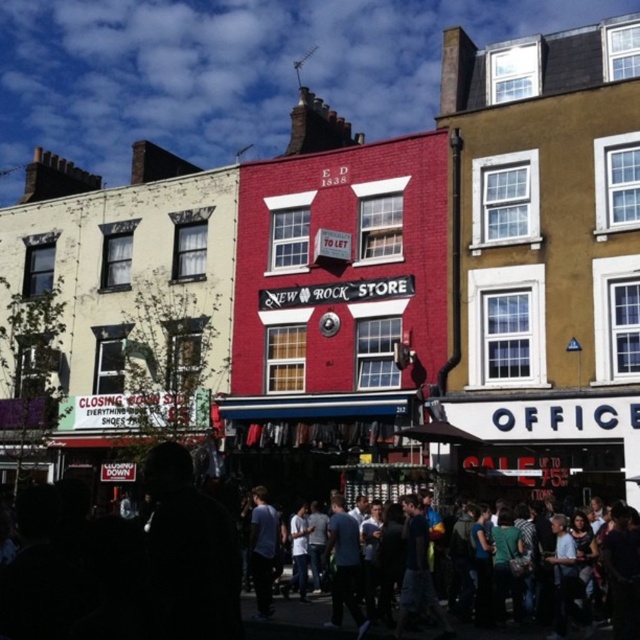
You are a street performer standing on the vibrant red brick building at center. You want to toss a coin to someone in the dark clothing crowd at center and light blue jeans at center. Which one is closer to you?

The dark clothing crowd at center is 11.74 meters from light blue jeans at center. Therefore, the light blue jeans at center is closer to you than the dark clothing crowd at center.

You are standing at the entrance of the cream colored building on the left. You want to walk to the red brick building in the center. Is the dark clothing crowd at center blocking your path?

The dark clothing crowd at center is located at point (x=136, y=572), so yes, it is blocking your path between the cream colored building on the left and the red brick building in the center.

You are standing at the point marked as point (x=136, y=572). Which building are you closest to?

The dark clothing crowd at center is located at point (x=136, y=572), so you are closest to the vibrant red brick building in the center.